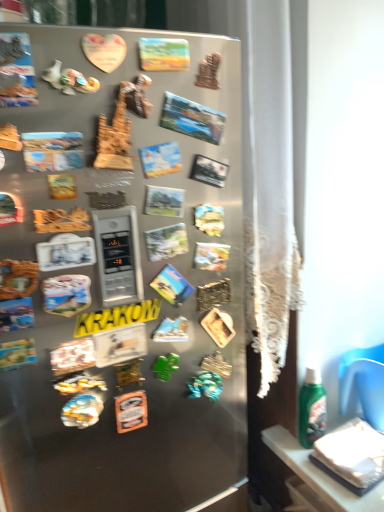
The height and width of the screenshot is (512, 384). Describe the element at coordinates (172, 286) in the screenshot. I see `matte plastic comic book at center, positioned as the 1th comic book in bottom-to-top order` at that location.

Measure the distance between matte plastic comic book at upper left, placed as the fifth comic book when sorted from bottom to top, and camera.

matte plastic comic book at upper left, placed as the fifth comic book when sorted from bottom to top, and camera are 26.57 inches apart from each other.

In order to click on matte plastic comic book at center, the 6th comic book ordered from the bottom in this screenshot , I will do [160, 159].

Where is `black matte comic book at center, positioned as the fourth comic book in bottom-to-top order`? Image resolution: width=384 pixels, height=512 pixels. black matte comic book at center, positioned as the fourth comic book in bottom-to-top order is located at coordinates (209, 170).

Is satin silver fridge at center surrounding matte paper comic book at center, which is counted as the third comic book, starting from the bottom?

Yes, satin silver fridge at center is surrounding matte paper comic book at center, which is counted as the third comic book, starting from the bottom.

Considering the sizes of satin silver fridge at center and matte paper comic book at center, marked as the 6th comic book in a top-to-bottom arrangement, in the image, is satin silver fridge at center wider or thinner than matte paper comic book at center, marked as the 6th comic book in a top-to-bottom arrangement,?

satin silver fridge at center is wider than matte paper comic book at center, marked as the 6th comic book in a top-to-bottom arrangement.

From the image's perspective, is satin silver fridge at center over matte paper comic book at center, marked as the 6th comic book in a top-to-bottom arrangement?

No, from the image's perspective, satin silver fridge at center is not above matte paper comic book at center, marked as the 6th comic book in a top-to-bottom arrangement.

How many degrees apart are the facing directions of satin silver fridge at center and matte paper comic book at center, which is counted as the third comic book, starting from the bottom?

The angle between the facing direction of satin silver fridge at center and the facing direction of matte paper comic book at center, which is counted as the third comic book, starting from the bottom, is 3.83 degrees.

Is matte paper comic book at center, marked as the 6th comic book in a top-to-bottom arrangement, aimed at black matte comic book at center, the fifth comic book positioned from the top?

No, matte paper comic book at center, marked as the 6th comic book in a top-to-bottom arrangement, is not turned towards black matte comic book at center, the fifth comic book positioned from the top.

Is matte paper comic book at center, which is counted as the third comic book, starting from the bottom, far away from black matte comic book at center, the fifth comic book positioned from the top?

That's not correct — matte paper comic book at center, which is counted as the third comic book, starting from the bottom, is a little close to black matte comic book at center, the fifth comic book positioned from the top.

From a real-world perspective, which object stands above the other?

matte plastic comic book at center, the 6th comic book ordered from the bottom.

You are a GUI agent. You are given a task and a screenshot of the screen. Output one action in this format:
    pyautogui.click(x=<x>, y=<y>)
    Task: Click on the 1st comic book to the left of the green plastic magnet at center, counting from the anchor's position
    This screenshot has height=512, width=384.
    Given the screenshot: What is the action you would take?
    point(160,159)

Considering the positions of objects green plastic magnet at center and matte plastic comic book at center, arranged as the third comic book when viewed from the top, in the image provided, who is more to the left, green plastic magnet at center or matte plastic comic book at center, arranged as the third comic book when viewed from the top,?

Positioned to the left is matte plastic comic book at center, arranged as the third comic book when viewed from the top.

Is point (170, 116) closer to camera compared to point (216, 298)?

Yes, point (170, 116) is in front of point (216, 298).

Is matte plastic comic book at upper center, placed as the second comic book when sorted from top to bottom, located outside satin silver fridge at center?

No, matte plastic comic book at upper center, placed as the second comic book when sorted from top to bottom, is inside satin silver fridge at center's boundary.

From a real-world perspective, which is physically above, matte plastic comic book at upper center, placed as the second comic book when sorted from top to bottom, or satin silver fridge at center?

From a 3D spatial view, matte plastic comic book at upper center, placed as the second comic book when sorted from top to bottom, is above.

From the image's perspective, who appears lower, matte plastic comic book at upper center, placed as the second comic book when sorted from top to bottom, or satin silver fridge at center?

satin silver fridge at center appears lower in the image.

Considering the relative sizes of black matte comic book at center, positioned as the fourth comic book in bottom-to-top order, and matte plastic comic book at upper left, the 4th comic book from the top, in the image provided, is black matte comic book at center, positioned as the fourth comic book in bottom-to-top order, smaller than matte plastic comic book at upper left, the 4th comic book from the top,?

Actually, black matte comic book at center, positioned as the fourth comic book in bottom-to-top order, might be larger than matte plastic comic book at upper left, the 4th comic book from the top.

From the image's perspective, is black matte comic book at center, positioned as the fourth comic book in bottom-to-top order, located beneath matte plastic comic book at upper left, placed as the fifth comic book when sorted from bottom to top?

Correct, black matte comic book at center, positioned as the fourth comic book in bottom-to-top order, appears lower than matte plastic comic book at upper left, placed as the fifth comic book when sorted from bottom to top, in the image.

Which object is positioned more to the left, black matte comic book at center, the fifth comic book positioned from the top, or matte plastic comic book at upper left, the 4th comic book from the top?

matte plastic comic book at upper left, the 4th comic book from the top.

Identify the location of the 1st comic book above the black matte comic book at center, the fifth comic book positioned from the top (from the image's perspective). The image size is (384, 512). (52, 151).

Considering the positions of points (142, 289) and (168, 143), is point (142, 289) closer to camera compared to point (168, 143)?

No.

Could you tell me if metallic digital display at center is turned towards matte plastic comic book at center, the 6th comic book ordered from the bottom?

No, metallic digital display at center does not turn towards matte plastic comic book at center, the 6th comic book ordered from the bottom.

Is metallic digital display at center inside the boundaries of matte plastic comic book at center, arranged as the third comic book when viewed from the top, or outside?

metallic digital display at center exists outside the volume of matte plastic comic book at center, arranged as the third comic book when viewed from the top.

Visually, is metallic digital display at center positioned to the left or to the right of matte plastic comic book at center, the 6th comic book ordered from the bottom?

In the image, metallic digital display at center appears on the left side of matte plastic comic book at center, the 6th comic book ordered from the bottom.

Is green glossy bottle at lower right inside or outside of green matte comic book at center, which appears as the 2th comic book when ordered from the bottom?

green glossy bottle at lower right is outside green matte comic book at center, which appears as the 2th comic book when ordered from the bottom.

Measure the distance between green glossy bottle at lower right and green matte comic book at center, which appears as the 2th comic book when ordered from the bottom.

23.03 inches.

From a real-world perspective, relative to green matte comic book at center, which appears as the 2th comic book when ordered from the bottom, is green glossy bottle at lower right vertically above or below?

From a real-world perspective, green glossy bottle at lower right is physically below green matte comic book at center, which appears as the 2th comic book when ordered from the bottom.

From the image's perspective, who appears lower, green glossy bottle at lower right or green matte comic book at center, which appears as the 2th comic book when ordered from the bottom?

green glossy bottle at lower right, from the image's perspective.

This screenshot has height=512, width=384. Find the location of `refrigerator below the matte paper comic book at center, which is counted as the third comic book, starting from the bottom (from a real-world perspective)`. refrigerator below the matte paper comic book at center, which is counted as the third comic book, starting from the bottom (from a real-world perspective) is located at coordinates pos(100,284).

From a real-world perspective, count 1st comic books upward from the matte paper comic book at center, which is counted as the third comic book, starting from the bottom, and point to it. Please provide its 2D coordinates.

[(209, 170)]

From the image, which object appears to be nearer to green plastic magnet at center, matte paper comic book at center, which is counted as the third comic book, starting from the bottom, or yellow matte sign at center?

yellow matte sign at center is positioned closer to the anchor green plastic magnet at center.

Which object lies nearer to the anchor point satin silver fridge at center, metallic digital display at center or green matte comic book at center, which appears as the 2th comic book when ordered from the bottom?

metallic digital display at center is closer to satin silver fridge at center.

When comparing their distances from matte paper comic book at center, marked as the 6th comic book in a top-to-bottom arrangement, does green matte comic book at center, which appears as the 2th comic book when ordered from the bottom, or matte plastic comic book at center, the 8th comic book from the top, seem further?

Among the two, matte plastic comic book at center, the 8th comic book from the top, is located further to matte paper comic book at center, marked as the 6th comic book in a top-to-bottom arrangement.

Estimate the real-world distances between objects in this image. Which object is closer to green plastic magnet at center, matte plastic comic book at center, the 8th comic book from the top, or metallic digital display at center?

Among the two, matte plastic comic book at center, the 8th comic book from the top, is located nearer to green plastic magnet at center.

Looking at the image, which one is located closer to metallic digital display at center, matte plastic comic book at upper center, placed as the second comic book when sorted from top to bottom, or green matte comic book at center, which appears as the 2th comic book when ordered from the bottom?

green matte comic book at center, which appears as the 2th comic book when ordered from the bottom, is closer to metallic digital display at center.

Looking at the image, which one is located further to matte plastic comic book at center, the 8th comic book from the top, metallic digital display at center or matte paper comic book at center, which is counted as the third comic book, starting from the bottom?

Based on the image, matte paper comic book at center, which is counted as the third comic book, starting from the bottom, appears to be further to matte plastic comic book at center, the 8th comic book from the top.

Based on their spatial positions, is matte paper comic book at center, which is counted as the third comic book, starting from the bottom, or green plastic magnet at center further from matte plastic comic book at upper center, which is the seventh comic book from bottom to top?

Based on the image, green plastic magnet at center appears to be further to matte plastic comic book at upper center, which is the seventh comic book from bottom to top.

When comparing their distances from pastel painted canvas at upper center, arranged as the first comic book when viewed from the top, does yellow matte sign at center or matte plastic comic book at upper left, placed as the fifth comic book when sorted from bottom to top, seem closer?

Among the two, matte plastic comic book at upper left, placed as the fifth comic book when sorted from bottom to top, is located nearer to pastel painted canvas at upper center, arranged as the first comic book when viewed from the top.

I want to click on comic book between black matte comic book at center, the fifth comic book positioned from the top, and green matte comic book at center, the seventh comic book viewed from the top, in the vertical direction, so click(164, 201).

Where is `appliance located between satin silver fridge at center and matte paper comic book at center, which is counted as the third comic book, starting from the bottom, in the depth direction`? The height and width of the screenshot is (512, 384). appliance located between satin silver fridge at center and matte paper comic book at center, which is counted as the third comic book, starting from the bottom, in the depth direction is located at coordinates (118, 255).

The image size is (384, 512). I want to click on writing positioned between satin silver fridge at center and green plastic magnet at center from near to far, so click(117, 317).

Identify the location of writing between black matte comic book at center, the fifth comic book positioned from the top, and white paper at lower right, in the vertical direction. The image size is (384, 512). (117, 317).